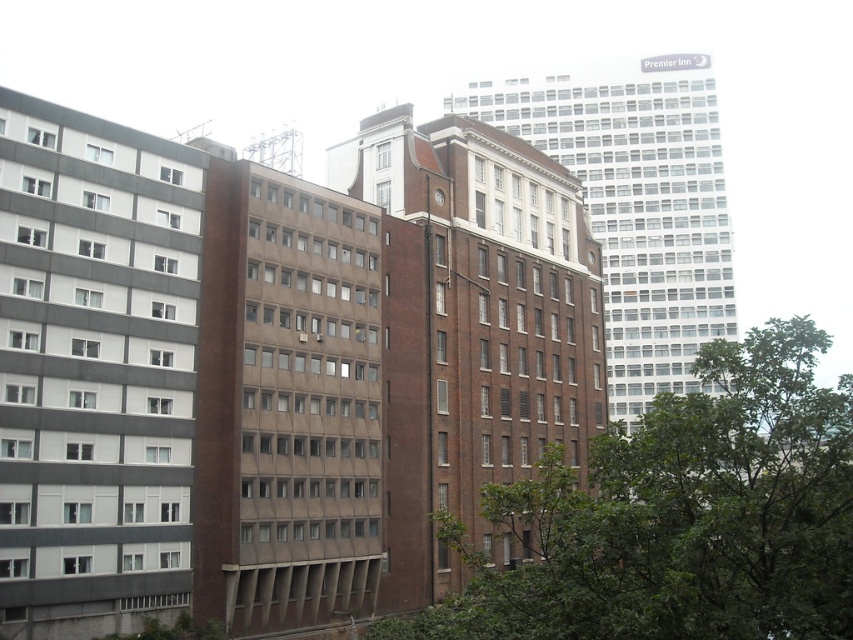
Looking at this image, you are an architect analyzing the cityscape. You notice the brown brick building at center and the metallic clock at center. Which structure has a greater height?

The brown brick building at center is much taller than the metallic clock at center, so the brown brick building at center has a greater height.

You are a city planner assessing the view from a new observation deck. The deck has a clear view of the green leafy tree at center and the metallic clock at center. Which object would block the view of the other if they were directly in line with the deck?

The green leafy tree at center is taller than the metallic clock at center, so it would block the view of the metallic clock at center if they were directly in line with the deck.

You are standing in the city park and see the green leafy tree at center. If you want to walk towards it, how many steps would you need to take? Assume each step is about 0.76 meters.

The green leafy tree at center is 17.99 meters away from you. Since each step covers approximately 0.76 meters, dividing the distance by step length gives roughly 23.67 steps. Therefore, you would need to take approximately 24 steps to reach the green leafy tree at center.